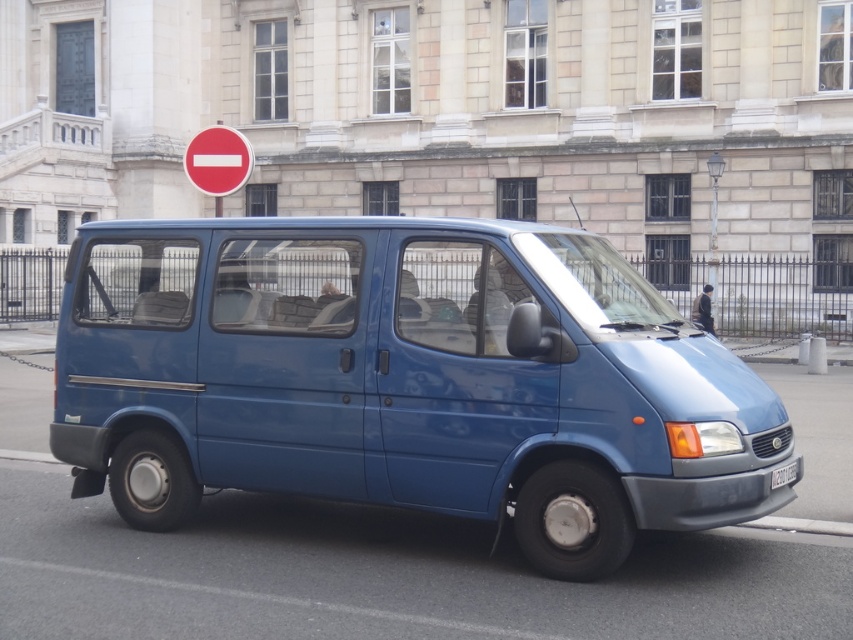
Between blue matte van at center and black plastic license plate at center, which one has less height?

black plastic license plate at center is shorter.

Does point (631, 332) come in front of point (791, 470)?

Yes.

Who is more forward, (x=225, y=422) or (x=796, y=467)?

Point (x=796, y=467)

I want to click on blue matte van at center, so click(405, 380).

Can you confirm if blue matte van at center is bigger than red matte sign at upper center?

Yes, blue matte van at center is bigger than red matte sign at upper center.

The width and height of the screenshot is (853, 640). In order to click on blue matte van at center in this screenshot , I will do `click(405, 380)`.

The height and width of the screenshot is (640, 853). In order to click on blue matte van at center in this screenshot , I will do `click(405, 380)`.

Consider the image. How much distance is there between red matte sign at upper center and black plastic license plate at center?

15.78 feet

Is point (223, 164) farther from viewer compared to point (796, 477)?

That is True.

I want to click on red matte sign at upper center, so click(x=218, y=161).

Identify the location of red matte sign at upper center. (218, 161).